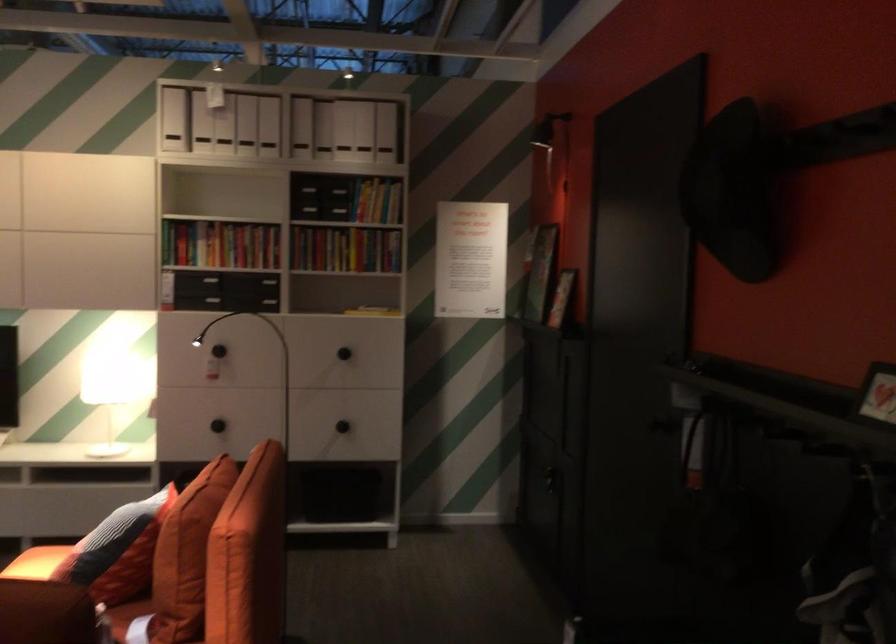
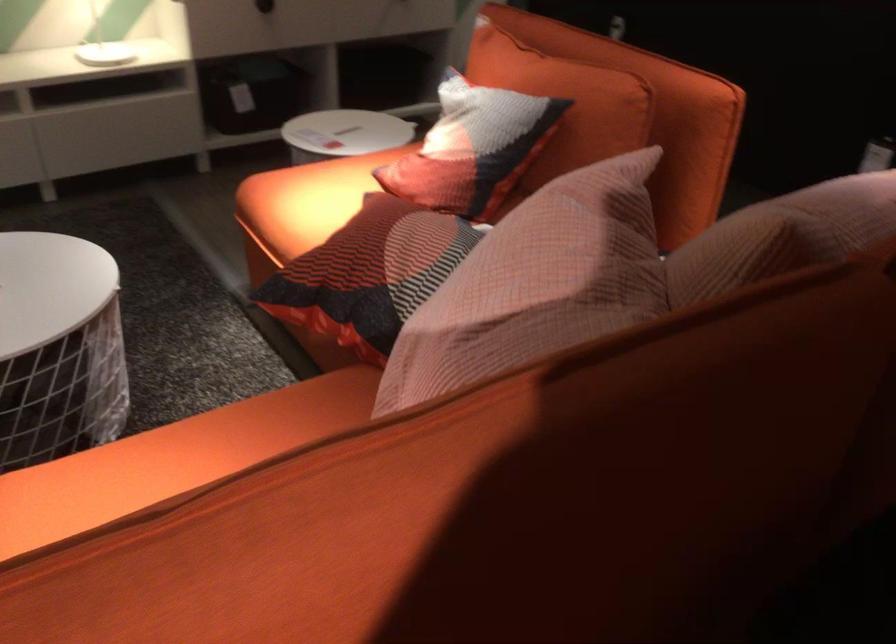
Where in the second image is the point corresponding to point 138,518 from the first image?

(564, 102)